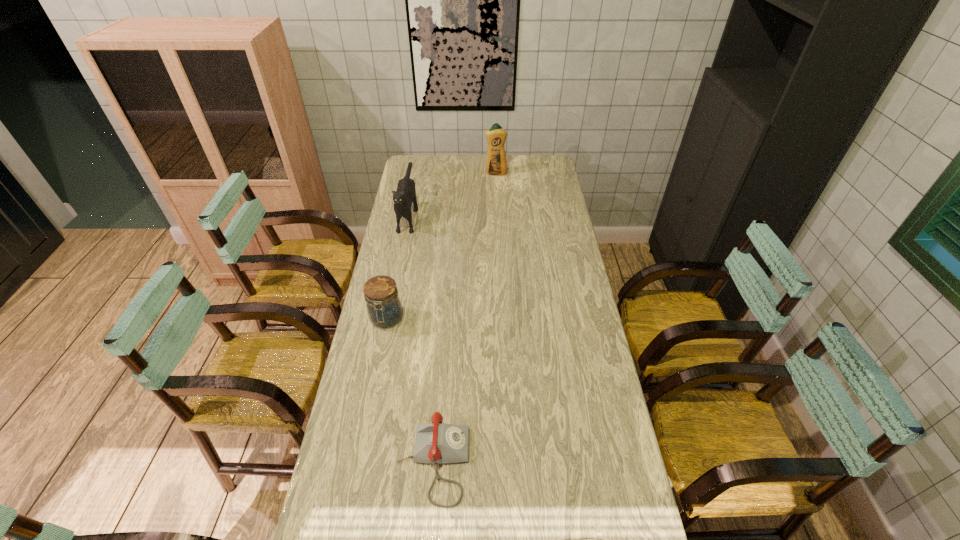
Find the location of `vacant point located on the lid of the second shortest object`. vacant point located on the lid of the second shortest object is located at coordinates (376, 367).

You are a GUI agent. You are given a task and a screenshot of the screen. Output one action in this format:
    pyautogui.click(x=<x>, y=<y>)
    Task: Click on the free region located 0.320m on the dial of the shortest object
    
    Given the screenshot: What is the action you would take?
    pyautogui.click(x=585, y=462)

The width and height of the screenshot is (960, 540). I want to click on object located at the far edge, so click(496, 165).

Identify the location of cat at the left edge. This screenshot has height=540, width=960. (405, 195).

Where is `jar present at the left edge`? The image size is (960, 540). jar present at the left edge is located at coordinates (383, 304).

I want to click on vacant area at the left edge, so click(361, 345).

The height and width of the screenshot is (540, 960). In order to click on vacant area at the right edge of the desktop in this screenshot , I will do `click(534, 198)`.

I want to click on free space at the far left corner, so click(414, 170).

This screenshot has height=540, width=960. Identify the location of vacant space at the far right corner of the desktop. (530, 158).

This screenshot has height=540, width=960. Identify the location of vacant space that is in between the nearest object and the second tallest object. (420, 337).